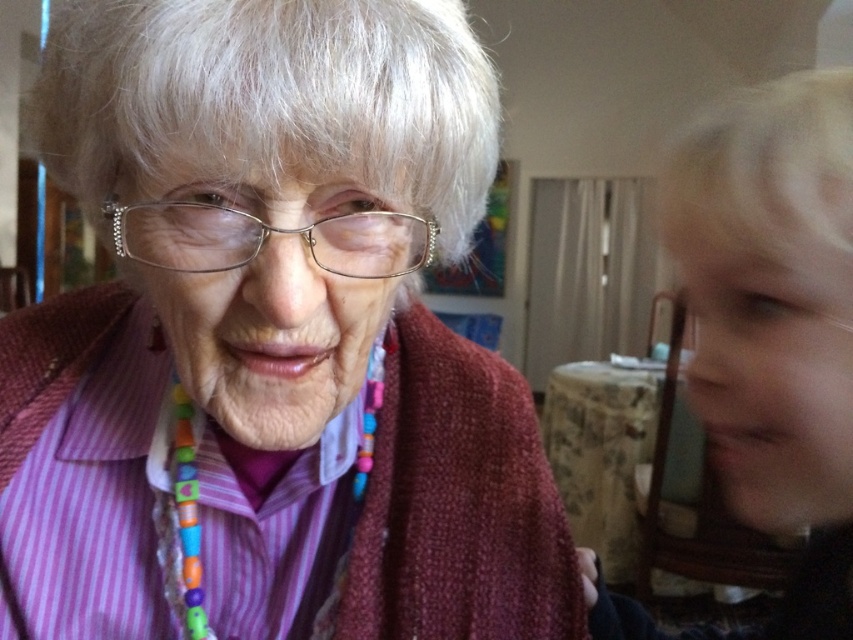
Question: Can you confirm if matte purple shirt at center is positioned below multicolored beaded necklace at right?

Choices:
 (A) no
 (B) yes

Answer: (A)

Question: Which point is farther to the camera?

Choices:
 (A) multicolored beaded necklace at right
 (B) matte purple shirt at center
 (C) metallic frame glasses at center

Answer: (C)

Question: Can you confirm if matte purple shirt at center is wider than metallic frame glasses at center?

Choices:
 (A) yes
 (B) no

Answer: (A)

Question: Does matte purple shirt at center lie in front of metallic frame glasses at center?

Choices:
 (A) yes
 (B) no

Answer: (A)

Question: Which point is closer to the camera taking this photo?

Choices:
 (A) (519, 506)
 (B) (374, 250)

Answer: (B)

Question: Considering the real-world distances, which object is farthest from the multicolored beaded necklace at right?

Choices:
 (A) matte purple shirt at center
 (B) metallic frame glasses at center

Answer: (B)